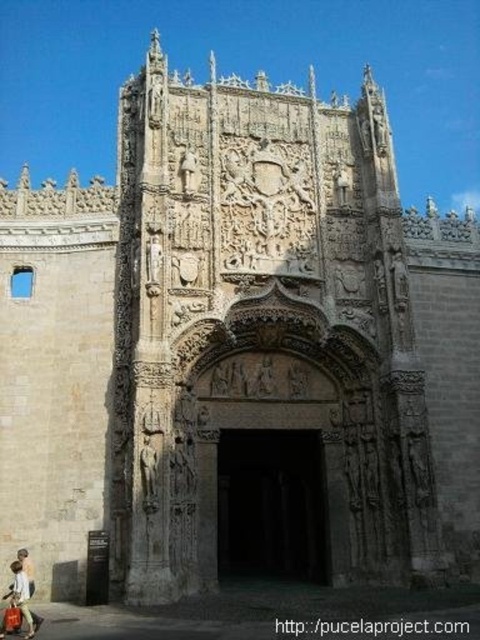
Does dark stone archway at center have a larger size compared to matte beige coat at lower left?

Yes.

Is dark stone archway at center below matte beige coat at lower left?

Yes, dark stone archway at center is below matte beige coat at lower left.

Is point (309, 548) behind point (14, 560)?

Yes, it is.

In order to click on dark stone archway at center in this screenshot , I will do `click(272, 506)`.